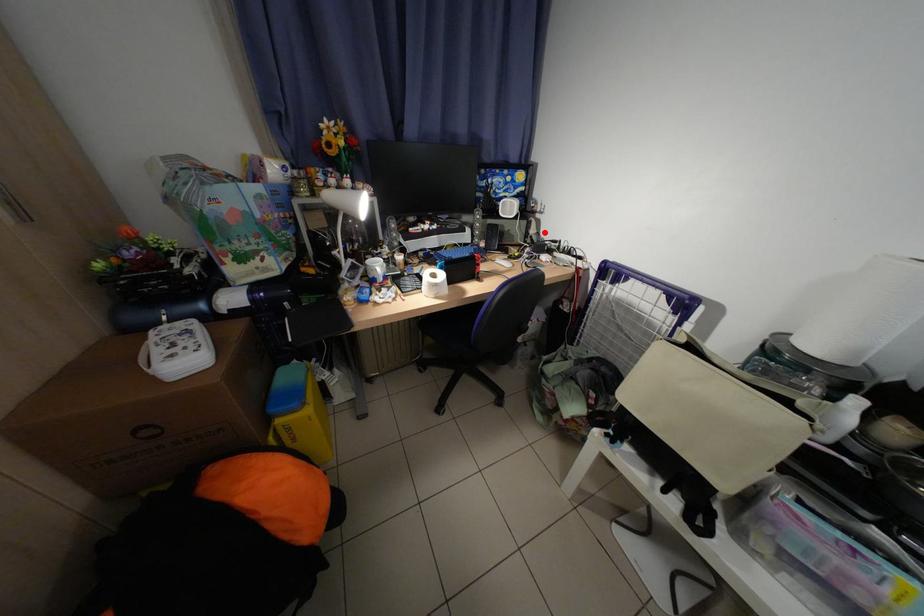
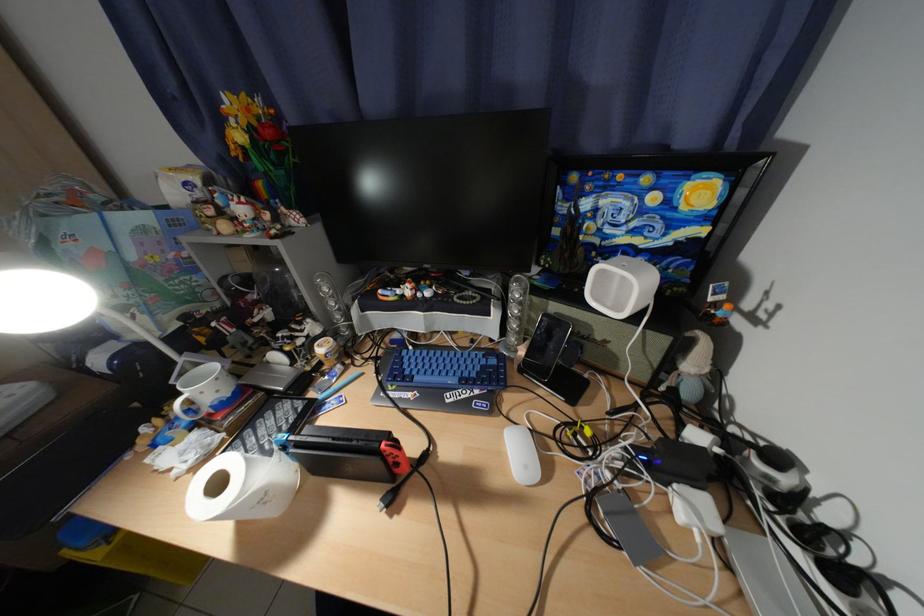
Question: I am providing you with two images of the same scene from different viewpoints. In image1, a red point is highlighted. Considering the same 3D point in image2, which of the following is correct?

Choices:
 (A) It is closer
 (B) It is farther

Answer: (B)